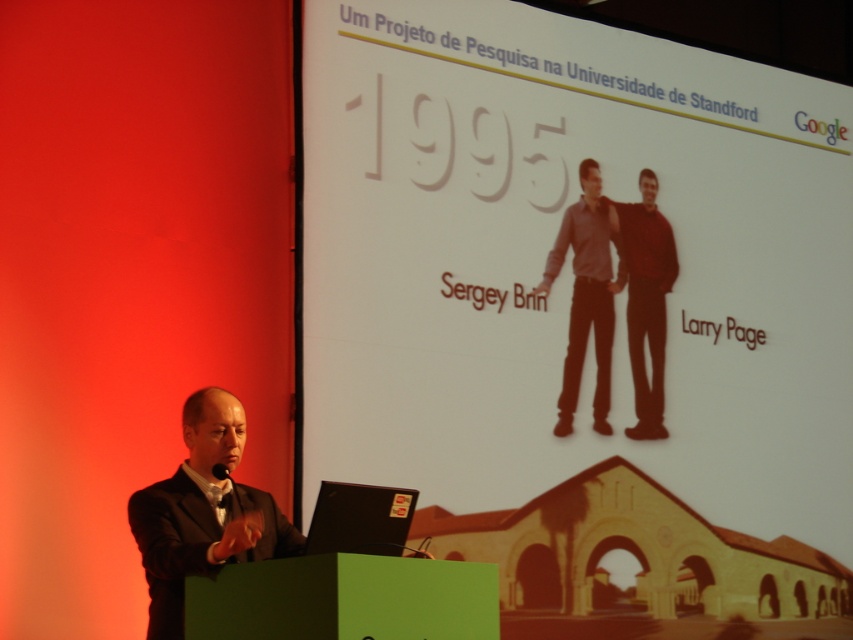
Question: Does white paper at upper center have a greater width compared to black matte laptop at lower center?

Choices:
 (A) no
 (B) yes

Answer: (B)

Question: Estimate the real-world distances between objects in this image. Which object is closer to the gray matte shirt at center?

Choices:
 (A) black matte laptop at lower center
 (B) dark red sweater at center
 (C) white paper at upper center

Answer: (B)

Question: Which of the following is the farthest from the observer?

Choices:
 (A) dark red sweater at center
 (B) black suit at left
 (C) gray matte shirt at center

Answer: (A)

Question: Does black suit at left have a larger size compared to black matte laptop at lower center?

Choices:
 (A) yes
 (B) no

Answer: (A)

Question: Which object is the farthest from the dark red sweater at center?

Choices:
 (A) black suit at left
 (B) black matte laptop at lower center
 (C) gray matte shirt at center

Answer: (A)

Question: Can you confirm if black suit at left is positioned to the right of dark red sweater at center?

Choices:
 (A) no
 (B) yes

Answer: (A)